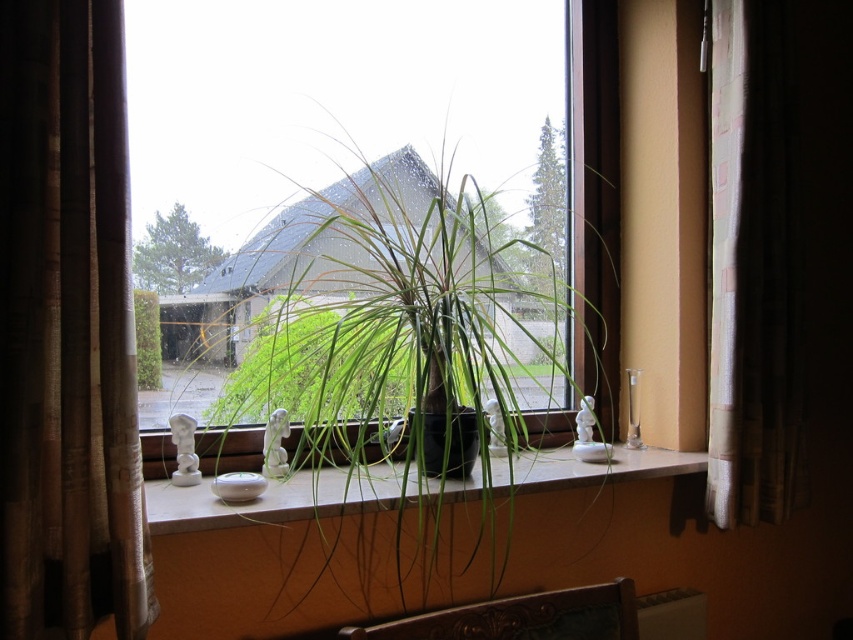
Is point (339, 20) positioned in front of point (141, 292)?

That is False.

Which is in front, point (164, 221) or point (154, 316)?

Positioned in front is point (154, 316).

Identify the location of transparent glass window at center. This screenshot has width=853, height=640. (366, 209).

Can you confirm if transparent glass window at center is smaller than green matte plant at center?

No.

I want to click on transparent glass window at center, so click(x=366, y=209).

Who is more distant from viewer, [163,275] or [346,509]?

The point [163,275] is behind.

This screenshot has width=853, height=640. In order to click on transparent glass window at center in this screenshot , I will do `click(366, 209)`.

Is transparent glass window at center thinner than brown textured curtain at right?

No, transparent glass window at center is not thinner than brown textured curtain at right.

Is transparent glass window at center below brown textured curtain at right?

No.

Image resolution: width=853 pixels, height=640 pixels. Describe the element at coordinates (366, 209) in the screenshot. I see `transparent glass window at center` at that location.

The height and width of the screenshot is (640, 853). Identify the location of transparent glass window at center. (366, 209).